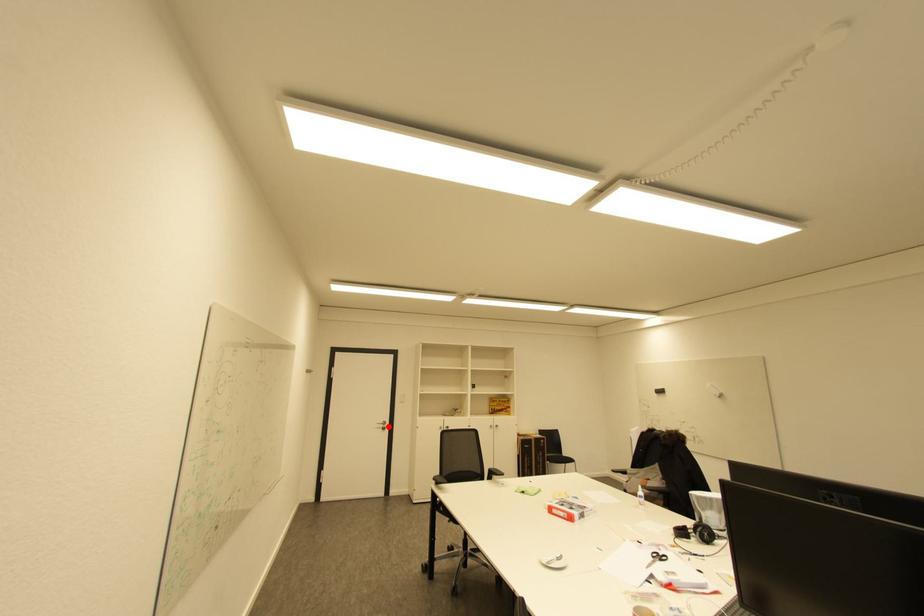
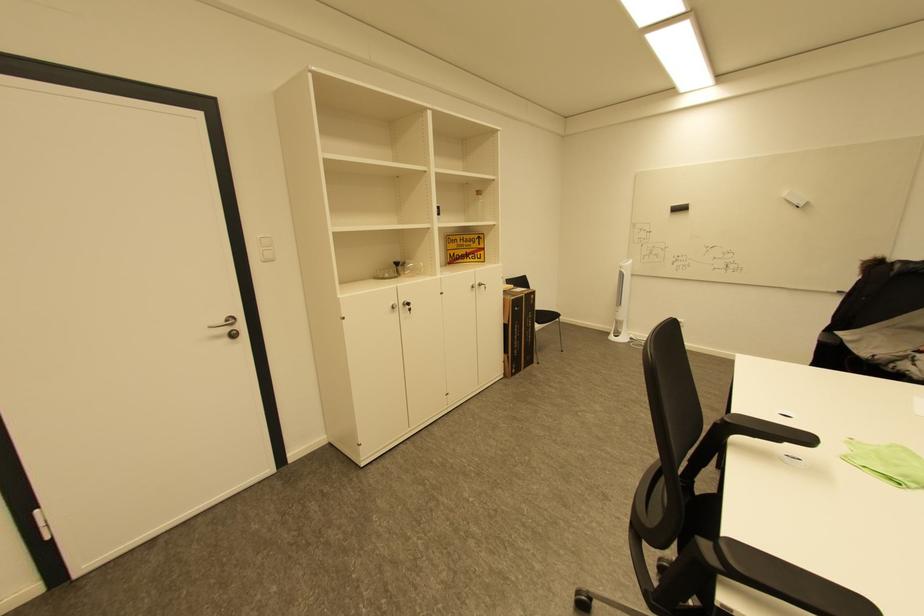
Locate, in the second image, the point that corresponds to the highlighted location in the first image.

(233, 330)